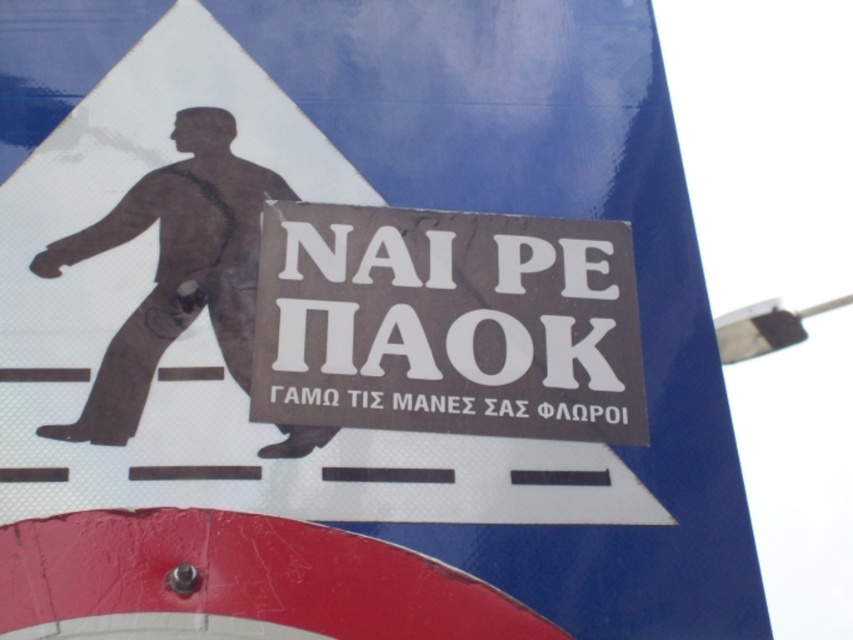
Is white paper sign at center shorter than brown matte figure at center?

Yes, white paper sign at center is shorter than brown matte figure at center.

Identify the location of white paper sign at center. (447, 323).